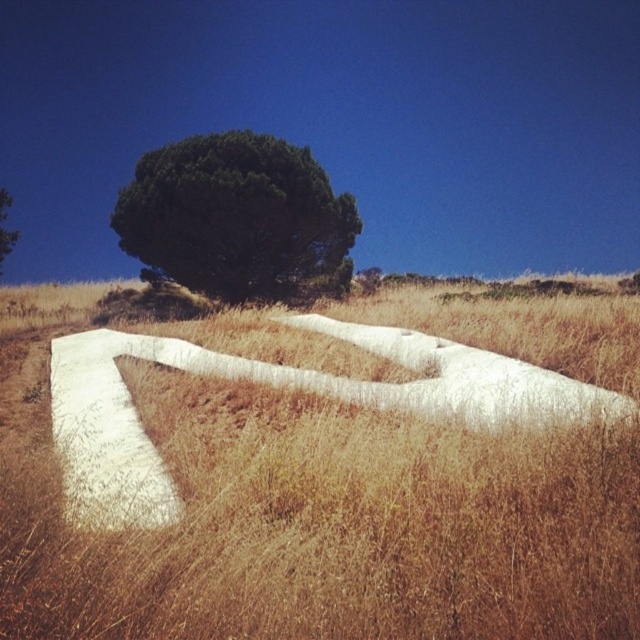
Is point (195, 192) behind point (3, 200)?

No, (195, 192) is in front of (3, 200).

Consider the image. Between green leafy tree at upper center and green leafy tree at upper left, which one is positioned higher?

green leafy tree at upper left is higher up.

Who is more distant from viewer, [154,186] or [1,189]?

The point [1,189] is more distant.

This screenshot has height=640, width=640. Identify the location of green leafy tree at upper center. (237, 218).

Is dry grass at center closer to camera compared to green leafy tree at upper left?

That is True.

Between dry grass at center and green leafy tree at upper left, which one appears on the right side from the viewer's perspective?

Positioned to the right is dry grass at center.

Which is in front, point (138, 541) or point (10, 248)?

Positioned in front is point (138, 541).

Find the location of `dry grass at center`. dry grass at center is located at coordinates (317, 522).

Can you confirm if dry grass at center is positioned to the right of green leafy tree at upper center?

Correct, you'll find dry grass at center to the right of green leafy tree at upper center.

Can you confirm if dry grass at center is wider than green leafy tree at upper center?

Correct, the width of dry grass at center exceeds that of green leafy tree at upper center.

Between point (307, 477) and point (234, 296), which one is positioned in front?

Positioned in front is point (307, 477).

Identify the location of dry grass at center. This screenshot has width=640, height=640. (317, 522).